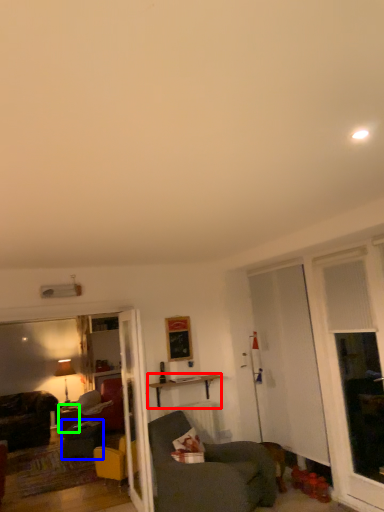
Question: Based on their relative distances, which object is farther from table (highlighted by a red box)? Choose from swivel chair (highlighted by a blue box) and desk (highlighted by a green box).

Choices:
 (A) swivel chair
 (B) desk

Answer: (B)